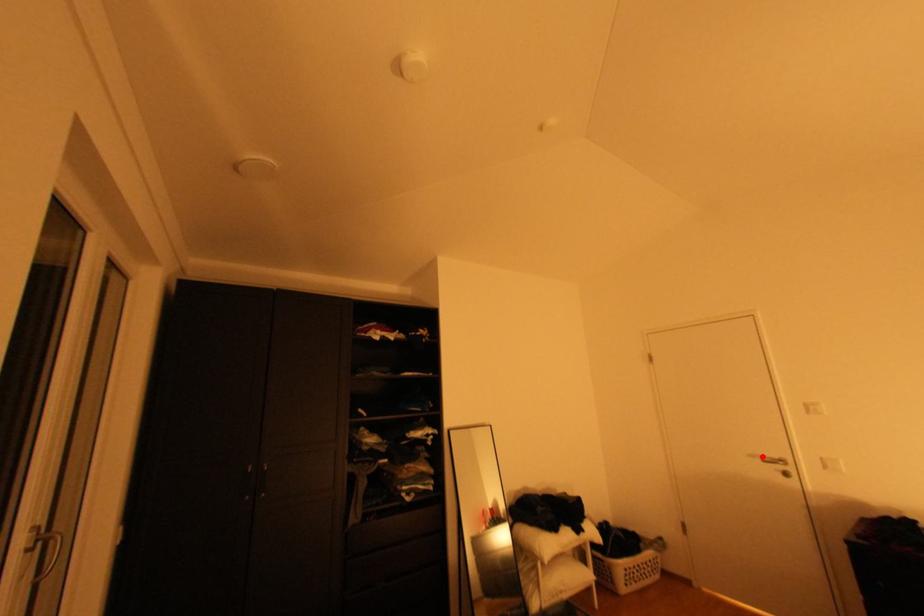
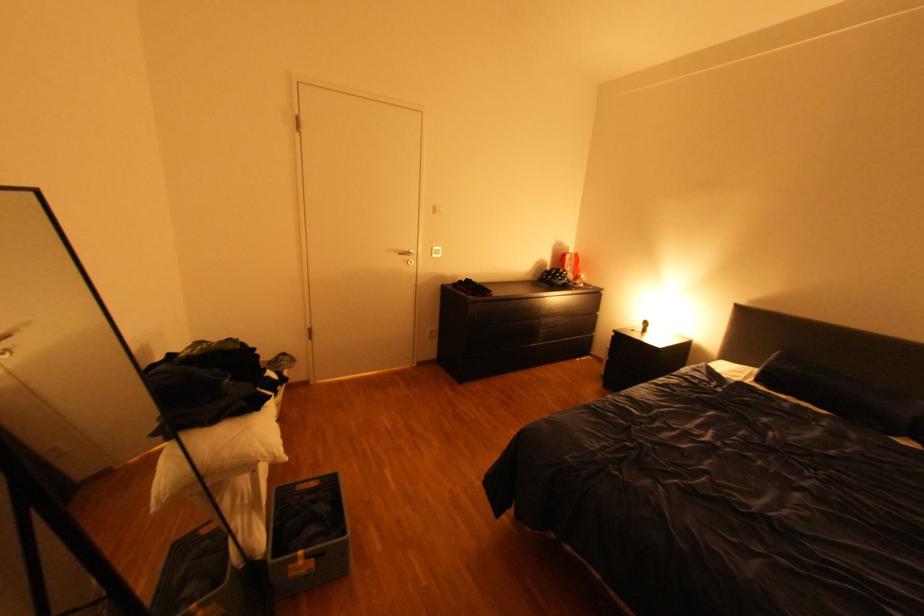
In the second image, find the point that corresponds to the highlighted location in the first image.

(399, 249)